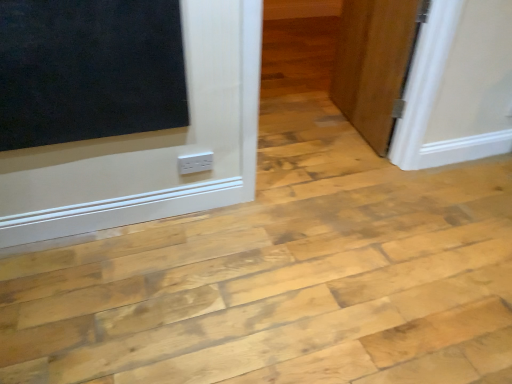
Question: Considering the positions of point (188, 162) and point (361, 89), is point (188, 162) closer or farther from the camera than point (361, 89)?

Choices:
 (A) farther
 (B) closer

Answer: (B)

Question: Relative to wooden door at right, is white plastic electric outlet at lower center in front or behind?

Choices:
 (A) behind
 (B) front

Answer: (B)

Question: Choose the correct answer: Is white plastic electric outlet at lower center inside wooden door at right or outside it?

Choices:
 (A) inside
 (B) outside

Answer: (B)

Question: In the image, is wooden door at right positioned in front of or behind white plastic electric outlet at lower center?

Choices:
 (A) behind
 (B) front

Answer: (A)

Question: Choose the correct answer: Is wooden door at right inside white plastic electric outlet at lower center or outside it?

Choices:
 (A) outside
 (B) inside

Answer: (A)

Question: From their relative heights in the image, would you say wooden door at right is taller or shorter than white plastic electric outlet at lower center?

Choices:
 (A) short
 (B) tall

Answer: (B)

Question: Is wooden door at right bigger or smaller than white plastic electric outlet at lower center?

Choices:
 (A) big
 (B) small

Answer: (A)